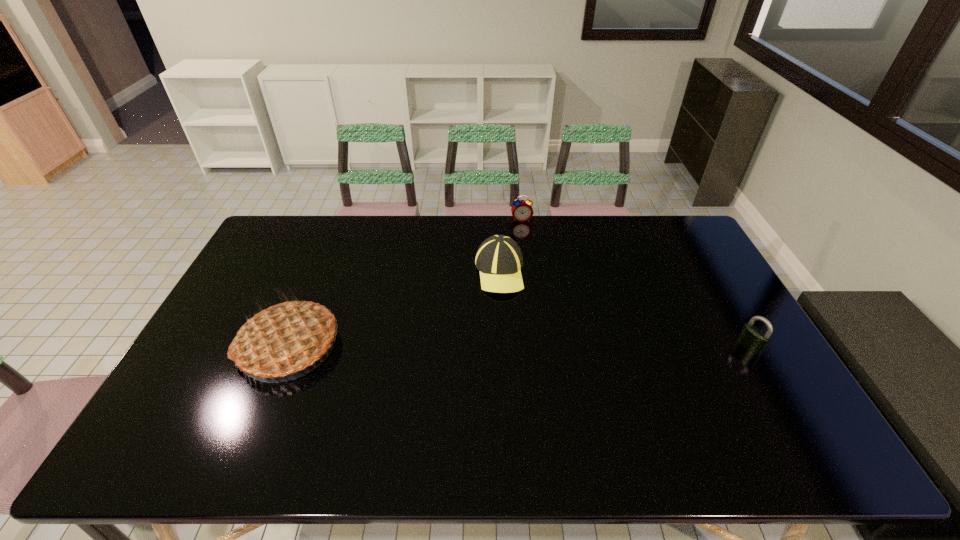
This screenshot has height=540, width=960. I want to click on free spot on the desktop that is between the tallest object and the padlock and is positioned with the brim of the baseball cap facing forward, so click(x=486, y=346).

The image size is (960, 540). I want to click on vacant space on the desktop that is between the tallest object and the padlock and is positioned on the front-facing side of the farthest object, so click(542, 346).